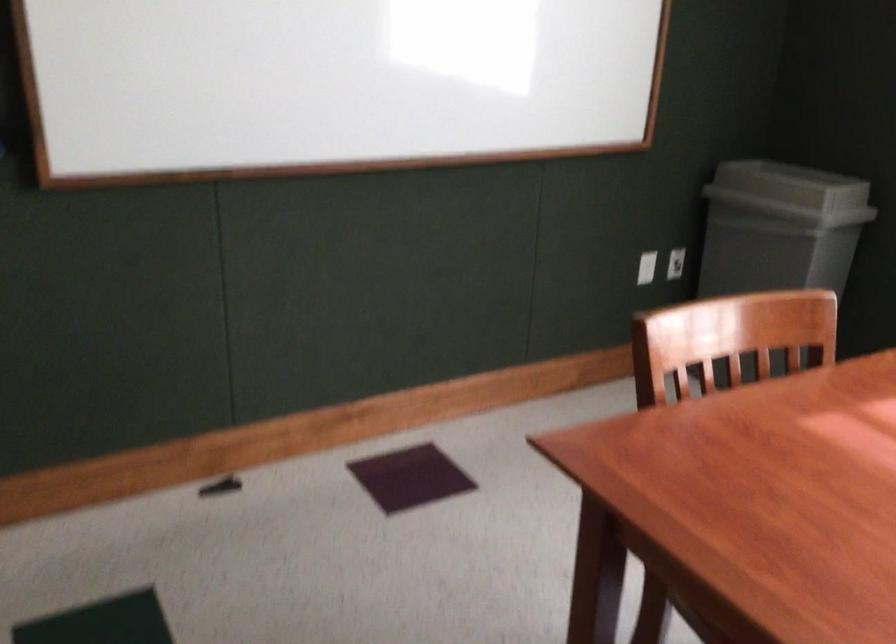
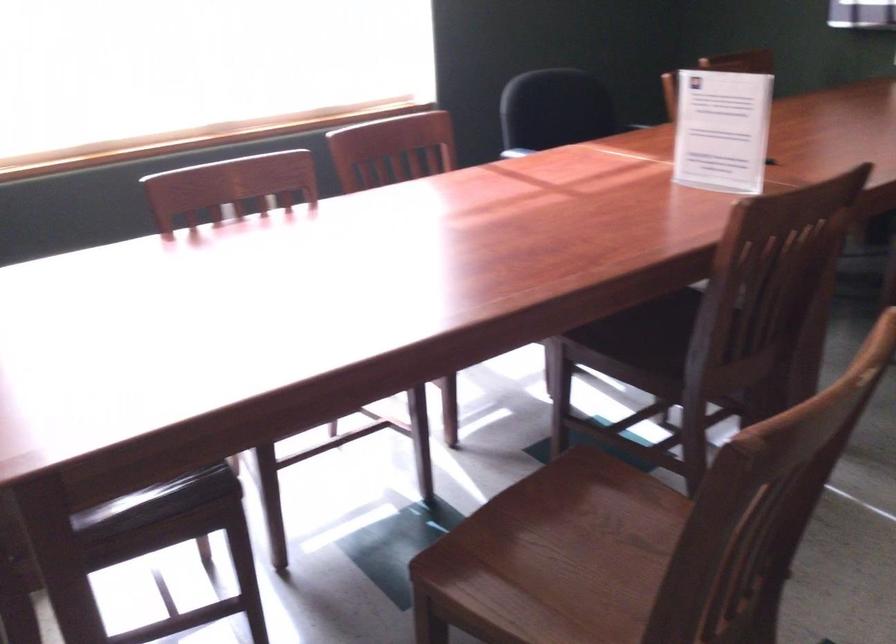
Based on the continuous images, in which direction is the camera rotating?

The rotation direction of the camera is right-down.